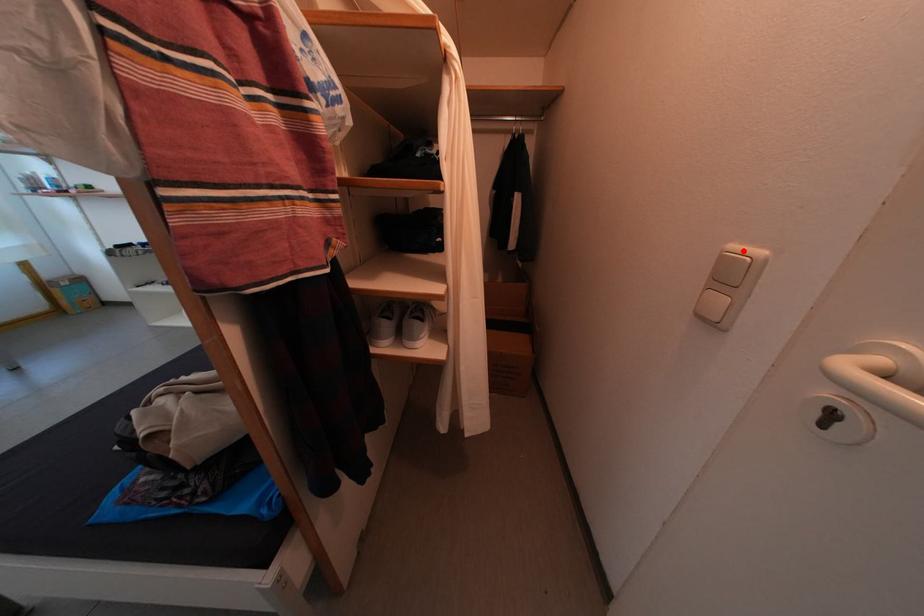
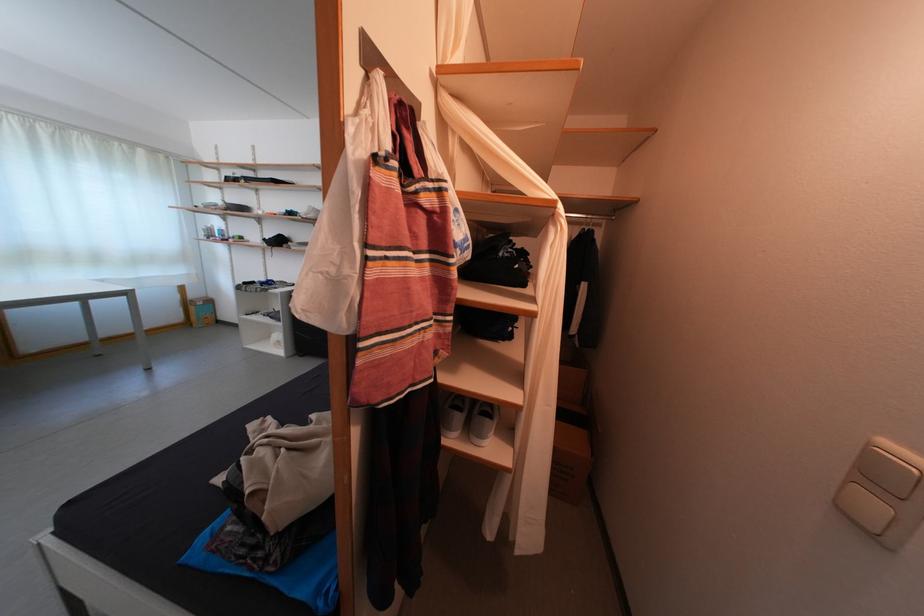
In the second image, find the point that corresponds to the highlighted location in the first image.

(894, 448)